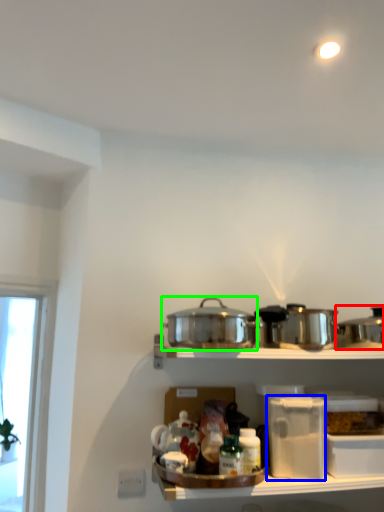
Question: Which object is the farthest from crock pot (highlighted by a red box)? Choose among these: appliance (highlighted by a blue box) or crock pot (highlighted by a green box).

Choices:
 (A) appliance
 (B) crock pot

Answer: (B)